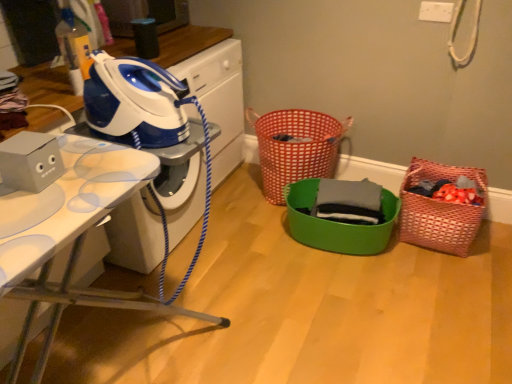
Question: From the image's perspective, is red woven basket at center, the first basket in the left-to-right sequence, located above or below gray cotton shirt at center?

Choices:
 (A) above
 (B) below

Answer: (A)

Question: Do you think red woven basket at center, the first basket in the left-to-right sequence, is within gray cotton shirt at center, or outside of it?

Choices:
 (A) inside
 (B) outside

Answer: (B)

Question: Estimate the real-world distances between objects in this image. Which object is farther from the blue glossy iron at left?

Choices:
 (A) white glossy ironing board at left
 (B) blue/white plastic iron at upper left, which appears as the 2th appliance when ordered from the bottom
 (C) gray cotton shirt at center
 (D) green plastic basket at center, marked as the 2th basket in a left-to-right arrangement
 (E) red woven basket at center, the third basket positioned from the right

Answer: (C)

Question: Which of these objects is positioned farthest from the white glossy ironing board at left?

Choices:
 (A) gray cotton shirt at center
 (B) woven pink basket at right, the third basket viewed from the left
 (C) blue glossy iron at left
 (D) blue/white plastic iron at upper left, which appears as the first appliance when viewed from the top
 (E) gray matte cardboard box at left, the 1th appliance when ordered from front to back

Answer: (B)